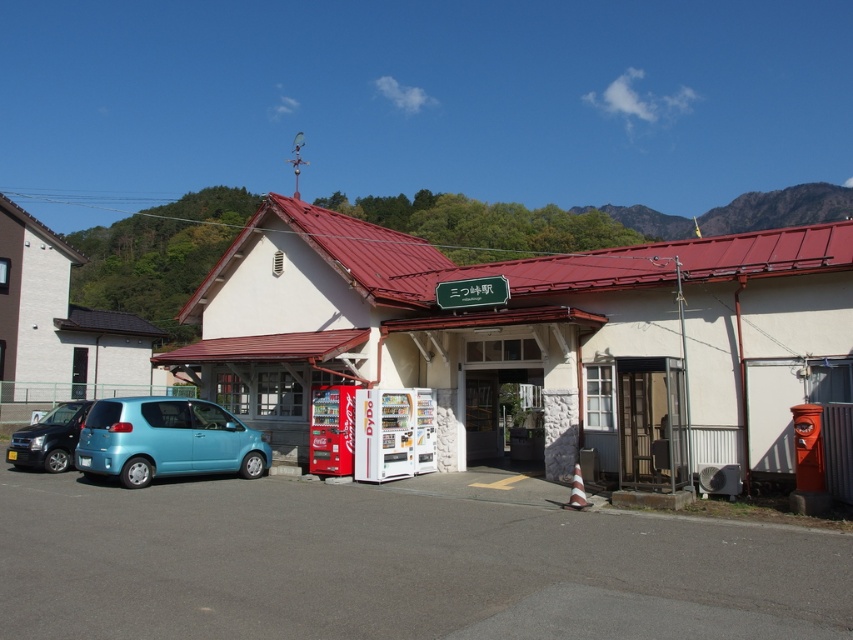
Question: Which point appears farthest from the camera in this image?

Choices:
 (A) (123, 419)
 (B) (355, 352)
 (C) (27, 429)

Answer: (C)

Question: Can you confirm if white matte building at center is smaller than matte black suv at lower left?

Choices:
 (A) no
 (B) yes

Answer: (A)

Question: Which point is closer to the camera taking this photo?

Choices:
 (A) (45, 429)
 (B) (173, 413)
 (C) (456, 444)

Answer: (B)

Question: Does white matte building at center come behind matte black suv at lower left?

Choices:
 (A) no
 (B) yes

Answer: (A)

Question: Is light blue matte hatchback at lower left further to the viewer compared to matte black suv at lower left?

Choices:
 (A) no
 (B) yes

Answer: (A)

Question: Which point is closer to the camera?

Choices:
 (A) pos(741,300)
 (B) pos(114,416)
 (C) pos(65,433)

Answer: (A)